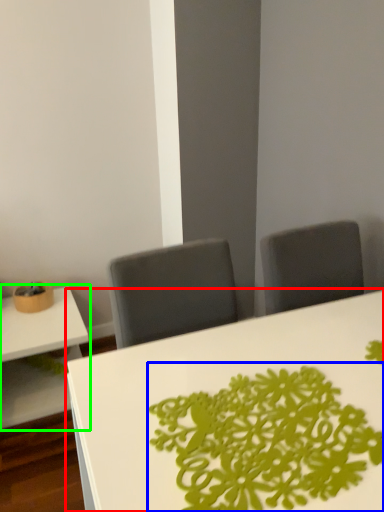
Question: Which object is positioned farthest from table (highlighted by a red box)? Select from floral arrangement (highlighted by a blue box) and table (highlighted by a green box).

Choices:
 (A) floral arrangement
 (B) table

Answer: (B)